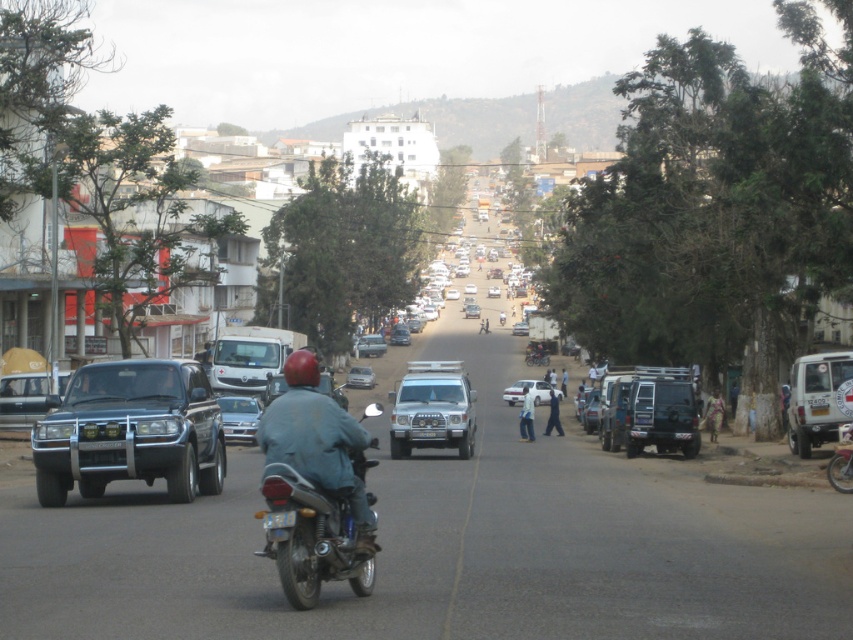
Who is higher up, light brown fabric dress at lower right or white plastic license plate at center?

white plastic license plate at center is above.

Is point (704, 426) in front of point (410, 433)?

No, it is not.

Image resolution: width=853 pixels, height=640 pixels. In order to click on light brown fabric dress at lower right in this screenshot , I will do `click(712, 413)`.

Is point (173, 440) closer to viewer compared to point (412, 435)?

Yes, it is.

Is metallic blue truck at left positioned in front of white plastic license plate at center?

Yes, it is in front of white plastic license plate at center.

Does point (218, 458) come farther from viewer compared to point (410, 436)?

No, (218, 458) is closer to viewer.

I want to click on metallic blue truck at left, so click(131, 432).

Describe the element at coordinates (131, 432) in the screenshot. I see `metallic blue truck at left` at that location.

Does metallic blue truck at left have a greater width compared to dark blue jeans at center?

Yes, metallic blue truck at left is wider than dark blue jeans at center.

Does point (180, 408) lie in front of point (555, 426)?

That is True.

You are a GUI agent. You are given a task and a screenshot of the screen. Output one action in this format:
    pyautogui.click(x=<x>, y=<y>)
    Task: Click on the metallic blue truck at left
    The width and height of the screenshot is (853, 640).
    Given the screenshot: What is the action you would take?
    pyautogui.click(x=131, y=432)